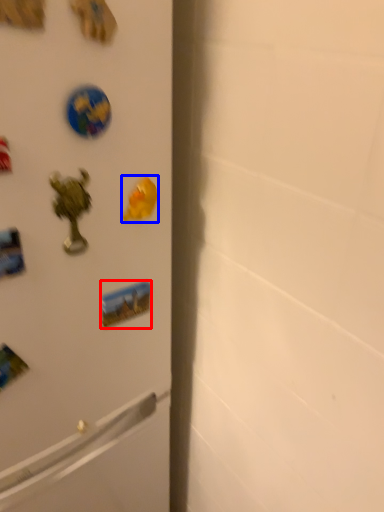
Question: Which object is closer to the camera taking this photo, sticker (highlighted by a red box) or magnet (highlighted by a blue box)?

Choices:
 (A) sticker
 (B) magnet

Answer: (B)